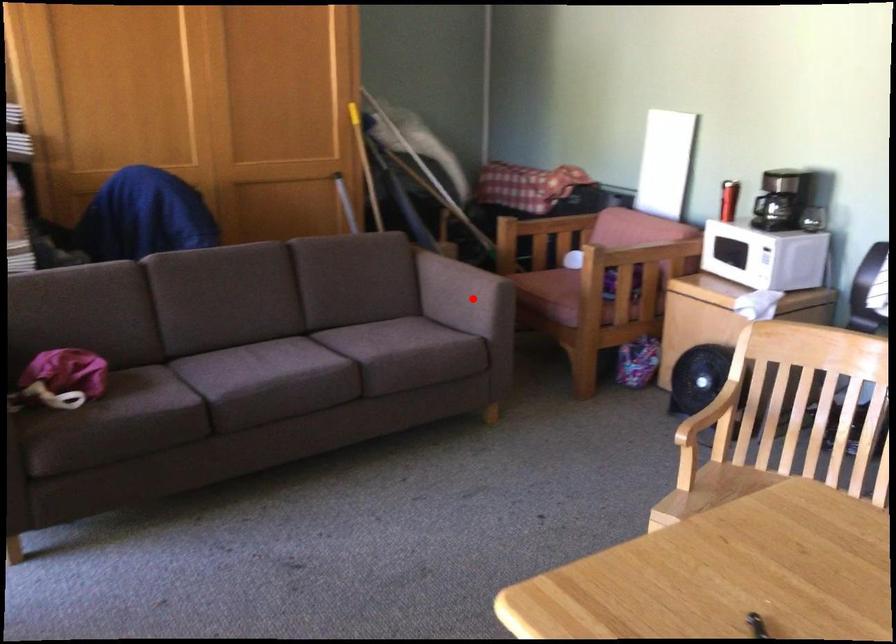
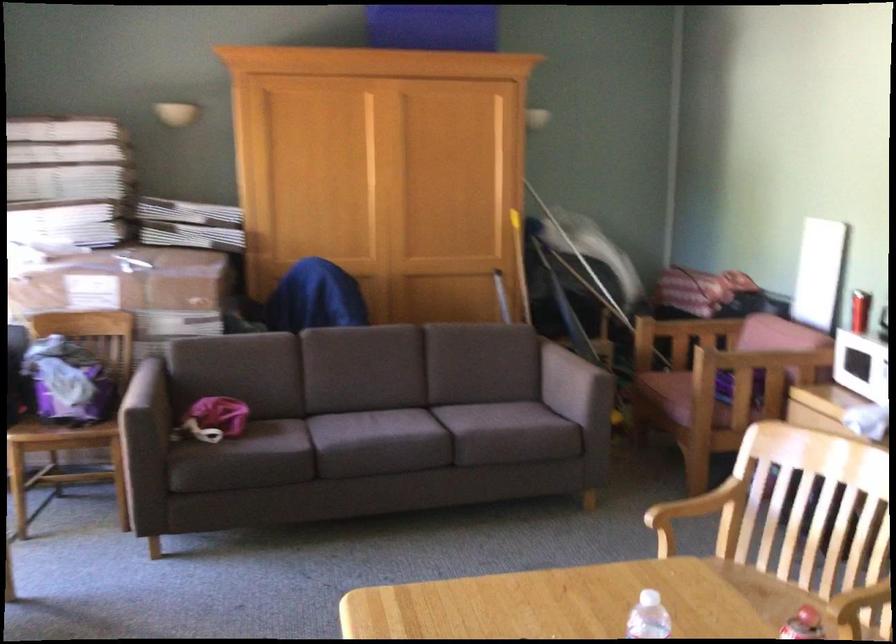
The point at the highlighted location is marked in the first image. Where is the corresponding point in the second image?

(574, 386)